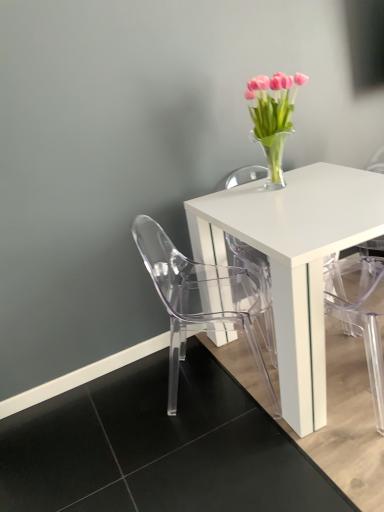
The width and height of the screenshot is (384, 512). I want to click on vacant area that is in front of transparent plastic chair at lower left, so click(x=234, y=459).